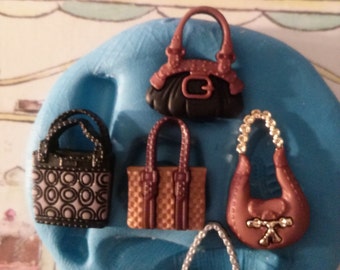
The height and width of the screenshot is (270, 340). Identify the location of solid handle. (227, 35).